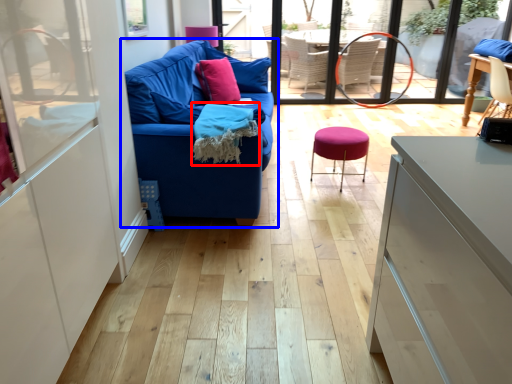
Question: Among these objects, which one is farthest to the camera, material (highlighted by a red box) or studio couch (highlighted by a blue box)?

Choices:
 (A) material
 (B) studio couch

Answer: (A)